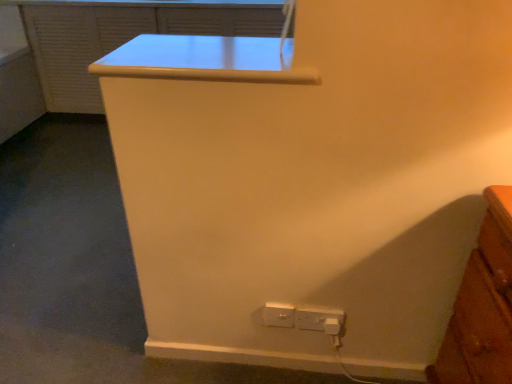
Question: Would you say white plastic power plugs and sockets at lower center, positioned as the second power plugs and sockets in right-to-left order, is to the left or to the right of white plastic power plugs and sockets at lower right, which is counted as the first power plugs and sockets, starting from the right, in the picture?

Choices:
 (A) right
 (B) left

Answer: (B)

Question: Is white plastic power plugs and sockets at lower center, positioned as the second power plugs and sockets in right-to-left order, in front of or behind white plastic power plugs and sockets at lower right, which is counted as the first power plugs and sockets, starting from the right, in the image?

Choices:
 (A) front
 (B) behind

Answer: (B)

Question: Considering the real-world distances, which object is farthest from the matte white file cabinet at upper center?

Choices:
 (A) white plastic power plugs and sockets at lower center, positioned as the second power plugs and sockets in right-to-left order
 (B) white plastic power plugs and sockets at lower right, which is counted as the second power plugs and sockets, starting from the left
 (C) white glossy table at upper center

Answer: (B)

Question: Which object is the farthest from the white plastic power plugs and sockets at lower right, which is counted as the second power plugs and sockets, starting from the left?

Choices:
 (A) white plastic power plugs and sockets at lower center, positioned as the second power plugs and sockets in right-to-left order
 (B) matte white file cabinet at upper center
 (C) white glossy table at upper center

Answer: (B)